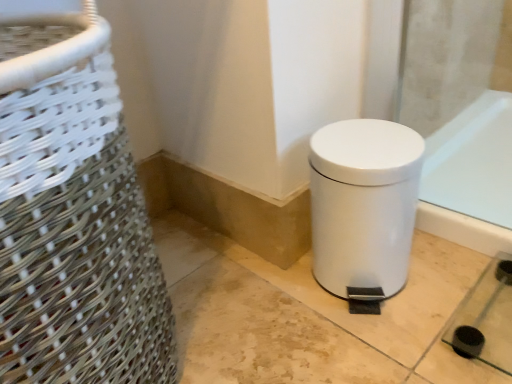
The width and height of the screenshot is (512, 384). I want to click on blank space to the left of white matte waste container at lower right, so click(x=262, y=307).